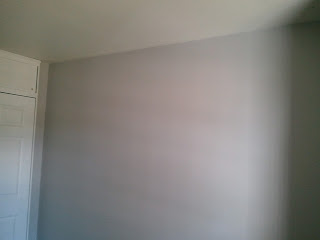
You are a GUI agent. You are given a task and a screenshot of the screen. Output one action in this format:
    pyautogui.click(x=<x>, y=<y>)
    Task: Click on the large panel on door
    This screenshot has width=320, height=240.
    Given the screenshot: What is the action you would take?
    pyautogui.click(x=12, y=169)